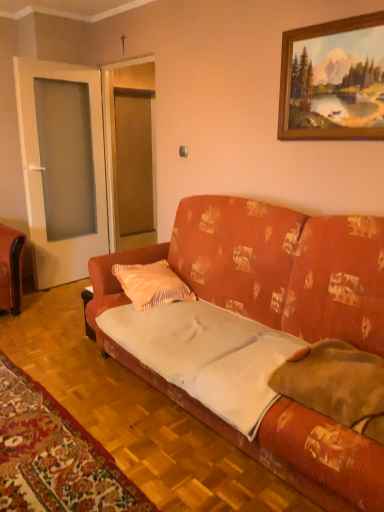
Question: From a real-world perspective, is wooden picture frame at upper right above or below white fabric mat at lower left?

Choices:
 (A) above
 (B) below

Answer: (A)

Question: Considering the positions of wooden picture frame at upper right and white fabric mat at lower left in the image, is wooden picture frame at upper right wider or thinner than white fabric mat at lower left?

Choices:
 (A) thin
 (B) wide

Answer: (A)

Question: Which is farther from the textured orange couch at center?

Choices:
 (A) white cotton sheet at center
 (B) orange velvet pillow at center, the 2th pillow from the front
 (C) wooden picture frame at upper right
 (D) beige fabric pillow at right, arranged as the 2th pillow when viewed from the left
 (E) white fabric mat at lower left

Answer: (C)

Question: Which object is the farthest from the orange velvet pillow at center, placed as the 1th pillow when sorted from back to front?

Choices:
 (A) beige fabric pillow at right, positioned as the first pillow in right-to-left order
 (B) wooden picture frame at upper right
 (C) transparent glass door at left
 (D) textured orange couch at center
 (E) white cotton sheet at center

Answer: (C)